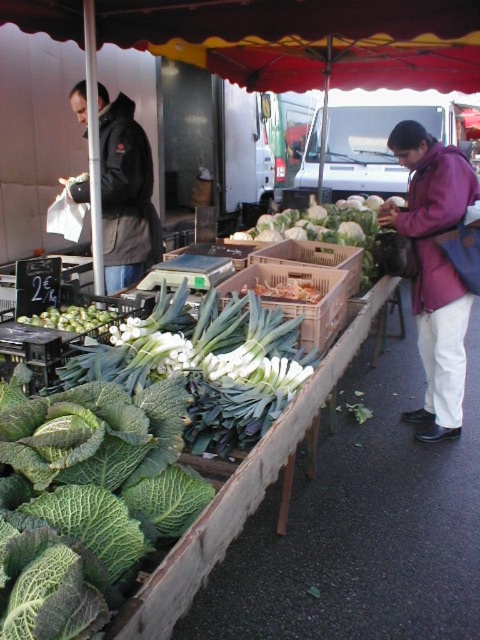
Question: Can you confirm if wooden crate at center is positioned to the right of green leafy vegetable at center?

Choices:
 (A) no
 (B) yes

Answer: (A)

Question: Is purple fleece jacket at right positioned at the back of green leafy vegetable at center?

Choices:
 (A) no
 (B) yes

Answer: (A)

Question: Among these points, which one is nearest to the camera?

Choices:
 (A) (445, 381)
 (B) (146, 212)

Answer: (A)

Question: Among these points, which one is nearest to the camera?

Choices:
 (A) (337, 220)
 (B) (430, 145)
 (C) (148, 160)

Answer: (B)

Question: Does wooden crate at center have a larger size compared to green leafy vegetable at center?

Choices:
 (A) no
 (B) yes

Answer: (A)

Question: Which of the following is the closest to the observer?

Choices:
 (A) (247, 234)
 (B) (50, 323)
 (C) (288, 314)

Answer: (B)